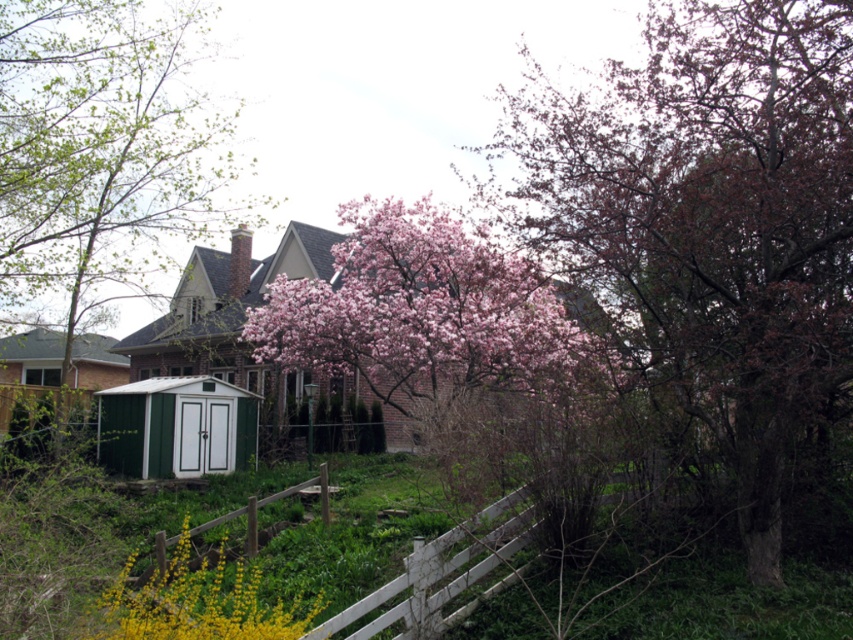
In the scene shown: You are a delivery person trying to park your van between the green painted wood shed at center and the green plastic shed at lower left. The van is 6 meters long. Can you fit it there?

The green painted wood shed at center is larger than the green plastic shed at lower left, but the exact distance between them isn not provided. Without knowing the space between the two sheds, it is impossible to determine if the van will fit.

Looking at this image, you are a drone operator trying to capture a photo of the pink textured tree at upper right and the green matte shed at lower left. From your current position, which object will appear larger in the photo?

Answer: The pink textured tree at upper right will appear larger in the photo because it is closer to the viewer than the green matte shed at lower left.

You are a delivery person trying to park your van between the green matte shed at lower left and the green painted wood shed at lower left. Can you fit your van there if it requires at least 2 meters of space?

The green matte shed at lower left is wider than the green painted wood shed at lower left, but the combined width of both sheds would need to be subtracted from the available space to determine if there is enough room. However, the exact dimensions of the space between them are not provided in the scene description, so it is unclear if the van can fit.